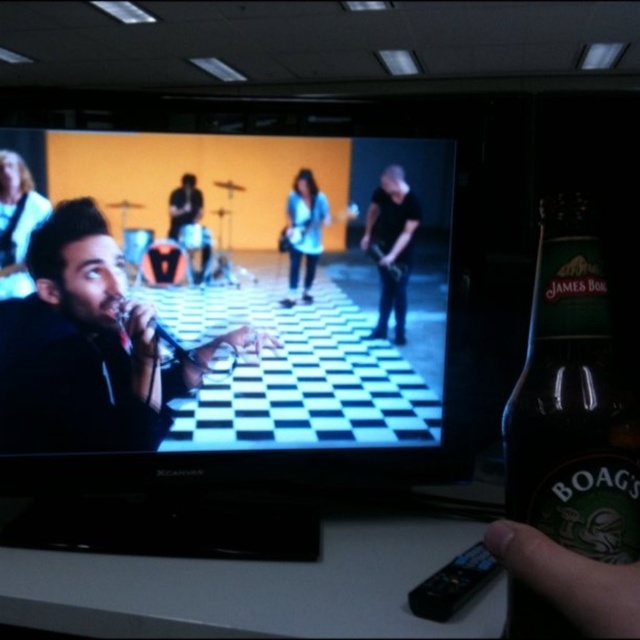
Which of these two, black matte microphone at center or shiny silver guitar at upper left, stands shorter?

Standing shorter between the two is shiny silver guitar at upper left.

Who is higher up, black matte microphone at center or shiny silver guitar at upper left?

shiny silver guitar at upper left is higher up.

Find the location of `black matte microphone at center`. black matte microphone at center is located at coordinates (88, 348).

Image resolution: width=640 pixels, height=640 pixels. Find the location of `black matte microphone at center`. black matte microphone at center is located at coordinates (88, 348).

Where is `matte black microphone at center`? Image resolution: width=640 pixels, height=640 pixels. matte black microphone at center is located at coordinates (232, 326).

Between matte black microphone at center and shiny silver guitar at upper left, which one is positioned higher?

shiny silver guitar at upper left

The width and height of the screenshot is (640, 640). I want to click on matte black microphone at center, so click(232, 326).

I want to click on matte black microphone at center, so click(232, 326).

Is green glass bottle at right behind light blue denim jacket at center?

No, green glass bottle at right is closer to the viewer.

Is point (614, 458) more distant than point (291, 268)?

No, (614, 458) is in front of (291, 268).

This screenshot has width=640, height=640. What do you see at coordinates (572, 401) in the screenshot?
I see `green glass bottle at right` at bounding box center [572, 401].

Locate an element on the screen. The image size is (640, 640). green glass bottle at right is located at coordinates (572, 401).